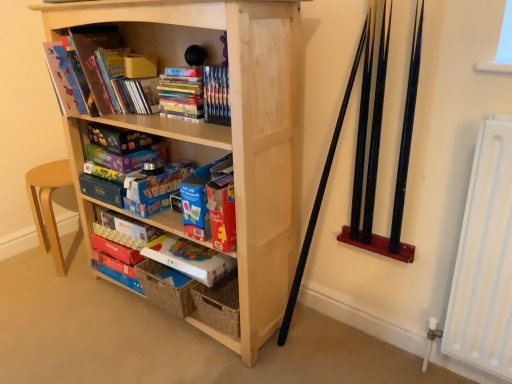
The image size is (512, 384). I want to click on matte purple board game at center, which appears as the second paperback book when viewed from the top, so click(x=125, y=157).

Image resolution: width=512 pixels, height=384 pixels. In order to click on matte cardboard book at upper left, the 1th book in the left-to-right sequence in this screenshot , I will do (138, 47).

What is the approximate height of natural wood bookcase at center?

natural wood bookcase at center is 3.73 feet in height.

Find the location of a particular element. The image size is (512, 384). matte cardboard book at center, the 3th paperback book ordered from the bottom is located at coordinates (129, 226).

Measure the distance between point (x=128, y=144) and camera.

5.40 feet.

Identify the location of matte purple board game at center, acting as the fifth paperback book starting from the bottom. The height and width of the screenshot is (384, 512). (125, 157).

Between blue cardboard box at center, which is counted as the 3th paperback book, starting from the top, and matte cardboard book at upper left, the 1th book in the left-to-right sequence, which one appears on the left side from the viewer's perspective?

matte cardboard book at upper left, the 1th book in the left-to-right sequence.

Locate an element on the screen. The image size is (512, 384). book that appears on the left of blue cardboard box at center, marked as the fourth paperback book in a bottom-to-top arrangement is located at coordinates (138, 47).

Consider the image. Which of these two, blue cardboard box at center, which is counted as the 3th paperback book, starting from the top, or matte cardboard book at upper left, the 1th book in the left-to-right sequence, is bigger?

Bigger between the two is matte cardboard book at upper left, the 1th book in the left-to-right sequence.

Can you confirm if blue cardboard box at center, marked as the fourth paperback book in a bottom-to-top arrangement, is taller than matte cardboard book at upper left, the 1th book in the left-to-right sequence?

Incorrect, the height of blue cardboard box at center, marked as the fourth paperback book in a bottom-to-top arrangement, is not larger of that of matte cardboard book at upper left, the 1th book in the left-to-right sequence.

Does matte cardboard book at upper left, the second book when ordered from right to left, have a lesser width compared to matte cardboard book at center, which is the 4th paperback book in top-to-bottom order?

No, matte cardboard book at upper left, the second book when ordered from right to left, is not thinner than matte cardboard book at center, which is the 4th paperback book in top-to-bottom order.

Does matte cardboard book at upper left, the second book when ordered from right to left, have a smaller size compared to matte cardboard book at center, the 3th paperback book ordered from the bottom?

Actually, matte cardboard book at upper left, the second book when ordered from right to left, might be larger than matte cardboard book at center, the 3th paperback book ordered from the bottom.

Based on their positions, is matte cardboard book at upper left, the 1th book in the left-to-right sequence, located to the left or right of matte cardboard book at center, which is the 4th paperback book in top-to-bottom order?

Based on their positions, matte cardboard book at upper left, the 1th book in the left-to-right sequence, is located to the left of matte cardboard book at center, which is the 4th paperback book in top-to-bottom order.

Relative to matte cardboard book at center, which is the 4th paperback book in top-to-bottom order, is matte cardboard book at upper left, the 1th book in the left-to-right sequence, in front or behind?

In the image, matte cardboard book at upper left, the 1th book in the left-to-right sequence, appears in front of matte cardboard book at center, which is the 4th paperback book in top-to-bottom order.

How different are the orientations of natural wood bookcase at center and red cardboard box at lower center, acting as the fifth paperback book starting from the top, in degrees?

0.805 degrees separate the facing orientations of natural wood bookcase at center and red cardboard box at lower center, acting as the fifth paperback book starting from the top.

Is natural wood bookcase at center touching red cardboard box at lower center, acting as the fifth paperback book starting from the top?

No, natural wood bookcase at center is not with red cardboard box at lower center, acting as the fifth paperback book starting from the top.

From a real-world perspective, starting from the natural wood bookcase at center, which paperback book is the 4th one below it? Please provide its 2D coordinates.

[(116, 250)]

Does point (279, 102) come behind point (104, 250)?

No.

From a real-world perspective, is white cardboard game box at center, the first paperback book when ordered from bottom to top, physically above blue cardboard box at center, marked as the fourth paperback book in a bottom-to-top arrangement?

Incorrect, from a real-world perspective, white cardboard game box at center, the first paperback book when ordered from bottom to top, is lower than blue cardboard box at center, marked as the fourth paperback book in a bottom-to-top arrangement.

Considering the positions of point (157, 243) and point (118, 182), is point (157, 243) closer or farther from the camera than point (118, 182)?

Clearly, point (157, 243) is closer to the camera than point (118, 182).

Could you measure the distance between white cardboard game box at center, the sixth paperback book viewed from the top, and blue cardboard box at center, marked as the fourth paperback book in a bottom-to-top arrangement?

white cardboard game box at center, the sixth paperback book viewed from the top, is 13.31 inches from blue cardboard box at center, marked as the fourth paperback book in a bottom-to-top arrangement.

Considering the positions of objects white cardboard game box at center, the sixth paperback book viewed from the top, and blue cardboard box at center, which is counted as the 3th paperback book, starting from the top, in the image provided, who is in front, white cardboard game box at center, the sixth paperback book viewed from the top, or blue cardboard box at center, which is counted as the 3th paperback book, starting from the top,?

Positioned in front is white cardboard game box at center, the sixth paperback book viewed from the top.

Would you consider matte cardboard book at center, which is the 4th paperback book in top-to-bottom order, to be distant from hardcover books at upper center, the first book in the right-to-left sequence?

No.

Which object is positioned more to the left, matte cardboard book at center, which is the 4th paperback book in top-to-bottom order, or hardcover books at upper center, the second book in the left-to-right sequence?

Positioned to the left is matte cardboard book at center, which is the 4th paperback book in top-to-bottom order.

In terms of size, does matte cardboard book at center, the 3th paperback book ordered from the bottom, appear bigger or smaller than hardcover books at upper center, the second book in the left-to-right sequence?

Considering their sizes, matte cardboard book at center, the 3th paperback book ordered from the bottom, takes up less space than hardcover books at upper center, the second book in the left-to-right sequence.

Is matte cardboard book at center, which is the 4th paperback book in top-to-bottom order, located outside hardcover books at upper center, the second book in the left-to-right sequence?

Yes, matte cardboard book at center, which is the 4th paperback book in top-to-bottom order, is not within hardcover books at upper center, the second book in the left-to-right sequence.

Image resolution: width=512 pixels, height=384 pixels. I want to click on the 1st book positioned above the red cardboard box at lower center, acting as the fifth paperback book starting from the top (from a real-world perspective), so click(196, 95).

From a real-world perspective, who is located higher, hardcover books at upper center, the second book in the left-to-right sequence, or red cardboard box at lower center, placed as the 2th paperback book when sorted from bottom to top?

hardcover books at upper center, the second book in the left-to-right sequence.

In terms of size, does hardcover books at upper center, the second book in the left-to-right sequence, appear bigger or smaller than red cardboard box at lower center, placed as the 2th paperback book when sorted from bottom to top?

Clearly, hardcover books at upper center, the second book in the left-to-right sequence, is larger in size than red cardboard box at lower center, placed as the 2th paperback book when sorted from bottom to top.

Which object is more forward, hardcover books at upper center, the first book in the right-to-left sequence, or red cardboard box at lower center, placed as the 2th paperback book when sorted from bottom to top?

hardcover books at upper center, the first book in the right-to-left sequence.

From the image's perspective, which is above, matte cardboard book at center, which is the 4th paperback book in top-to-bottom order, or matte purple board game at center, which appears as the second paperback book when viewed from the top?

matte purple board game at center, which appears as the second paperback book when viewed from the top, is shown above in the image.

Who is bigger, matte cardboard book at center, the 3th paperback book ordered from the bottom, or matte purple board game at center, acting as the fifth paperback book starting from the bottom?

matte cardboard book at center, the 3th paperback book ordered from the bottom.

Which is in front, matte cardboard book at center, which is the 4th paperback book in top-to-bottom order, or matte purple board game at center, acting as the fifth paperback book starting from the bottom?

matte purple board game at center, acting as the fifth paperback book starting from the bottom, is closer to the camera.

This screenshot has width=512, height=384. In order to click on book that is on the left side of blue cardboard box at center, marked as the fourth paperback book in a bottom-to-top arrangement in this screenshot , I will do `click(138, 47)`.

From a real-world perspective, which book is the 2nd one above the matte cardboard book at center, the 3th paperback book ordered from the bottom? Please provide its 2D coordinates.

[(138, 47)]

Estimate the real-world distances between objects in this image. Which object is closer to matte cardboard book at center, the 3th paperback book ordered from the bottom, natural wood bookcase at center or matte blue board game at center, the 6th paperback book when ordered from bottom to top?

matte blue board game at center, the 6th paperback book when ordered from bottom to top, lies closer to matte cardboard book at center, the 3th paperback book ordered from the bottom, than the other object.

Which object lies nearer to the anchor point red cardboard box at lower center, acting as the fifth paperback book starting from the top, matte purple board game at center, acting as the fifth paperback book starting from the bottom, or matte cardboard book at center, which is the 4th paperback book in top-to-bottom order?

Based on the image, matte cardboard book at center, which is the 4th paperback book in top-to-bottom order, appears to be nearer to red cardboard box at lower center, acting as the fifth paperback book starting from the top.

Considering their positions, is matte cardboard book at center, the 3th paperback book ordered from the bottom, positioned further to natural wood bookcase at center than red cardboard box at lower center, placed as the 2th paperback book when sorted from bottom to top?

Based on the image, red cardboard box at lower center, placed as the 2th paperback book when sorted from bottom to top, appears to be further to natural wood bookcase at center.

Considering their positions, is matte cardboard book at center, which is the 4th paperback book in top-to-bottom order, positioned closer to matte cardboard book at upper left, the second book when ordered from right to left, than natural wood bookcase at center?

natural wood bookcase at center lies closer to matte cardboard book at upper left, the second book when ordered from right to left, than the other object.

From the image, which object appears to be nearer to blue cardboard box at center, marked as the fourth paperback book in a bottom-to-top arrangement, red cardboard box at lower center, placed as the 2th paperback book when sorted from bottom to top, or hardcover books at upper center, the first book in the right-to-left sequence?

red cardboard box at lower center, placed as the 2th paperback book when sorted from bottom to top, lies closer to blue cardboard box at center, marked as the fourth paperback book in a bottom-to-top arrangement, than the other object.

When comparing their distances from white cardboard game box at center, the sixth paperback book viewed from the top, does matte cardboard book at center, the 3th paperback book ordered from the bottom, or hardcover books at upper center, the first book in the right-to-left sequence, seem closer?

Based on the image, matte cardboard book at center, the 3th paperback book ordered from the bottom, appears to be nearer to white cardboard game box at center, the sixth paperback book viewed from the top.

Based on their spatial positions, is hardcover books at upper center, the second book in the left-to-right sequence, or red cardboard box at lower center, placed as the 2th paperback book when sorted from bottom to top, further from matte purple board game at center, acting as the fifth paperback book starting from the bottom?

red cardboard box at lower center, placed as the 2th paperback book when sorted from bottom to top, is positioned further to the anchor matte purple board game at center, acting as the fifth paperback book starting from the bottom.

Looking at the image, which one is located closer to blue cardboard box at center, which is counted as the 3th paperback book, starting from the top, matte cardboard book at center, which is the 4th paperback book in top-to-bottom order, or hardcover books at upper center, the first book in the right-to-left sequence?

matte cardboard book at center, which is the 4th paperback book in top-to-bottom order, lies closer to blue cardboard box at center, which is counted as the 3th paperback book, starting from the top, than the other object.

Where is `bookcase between hardcover books at upper center, the first book in the right-to-left sequence, and white cardboard game box at center, the first paperback book when ordered from bottom to top, in the vertical direction`? bookcase between hardcover books at upper center, the first book in the right-to-left sequence, and white cardboard game box at center, the first paperback book when ordered from bottom to top, in the vertical direction is located at coordinates (223, 130).

At what (x,y) coordinates should I click in order to perform the action: click on book between matte cardboard book at upper left, the 1th book in the left-to-right sequence, and matte cardboard book at center, the 3th paperback book ordered from the bottom, in the vertical direction. Please return your answer as a coordinate pair (x, y). The width and height of the screenshot is (512, 384). Looking at the image, I should click on (196, 95).

This screenshot has width=512, height=384. Identify the location of bookcase between matte cardboard book at upper left, the second book when ordered from right to left, and white cardboard game box at center, the first paperback book when ordered from bottom to top, in the up-down direction. (223, 130).

Identify the location of book between matte cardboard book at upper left, the second book when ordered from right to left, and white cardboard game box at center, the first paperback book when ordered from bottom to top, in the up-down direction. (196, 95).